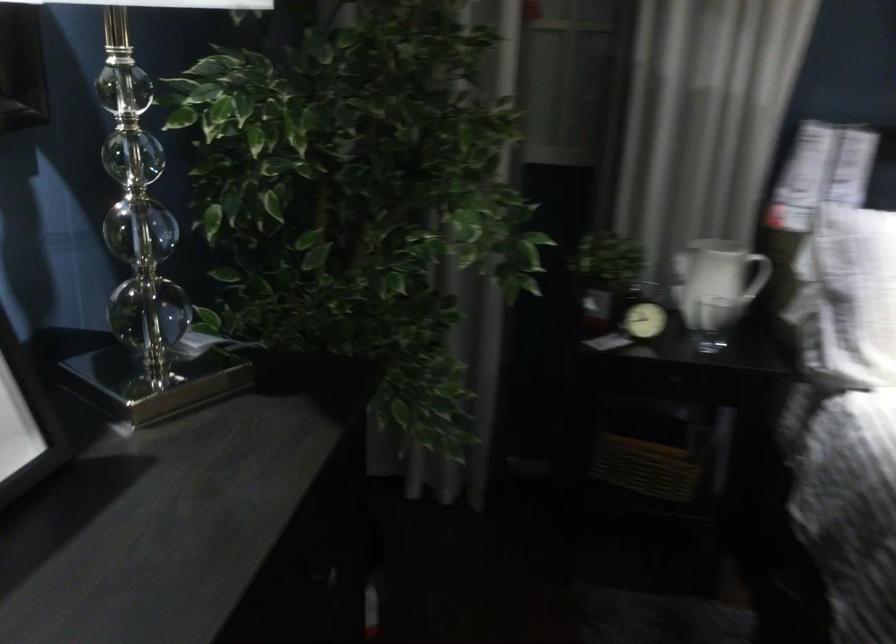
Locate an element on the screen. The image size is (896, 644). round alarm clock is located at coordinates (643, 321).